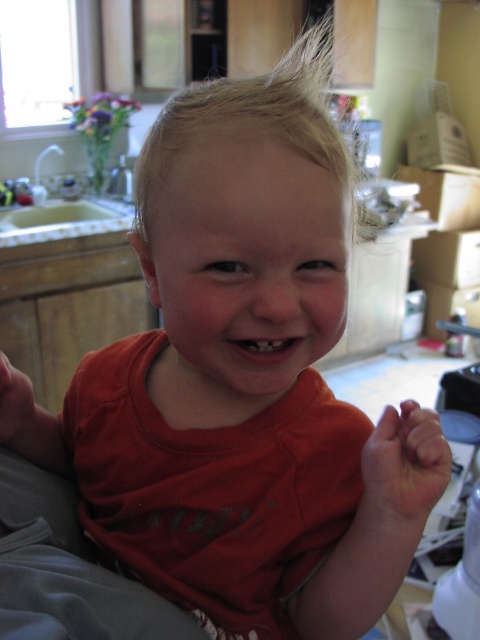
Is smooth skin hand at lower right positioned behind matte orange shirt at lower left?

No, it is not.

Is smooth skin hand at lower right to the left of matte orange shirt at lower left from the viewer's perspective?

In fact, smooth skin hand at lower right is to the right of matte orange shirt at lower left.

Where is `smooth skin hand at lower right`? The width and height of the screenshot is (480, 640). smooth skin hand at lower right is located at coordinates (403, 472).